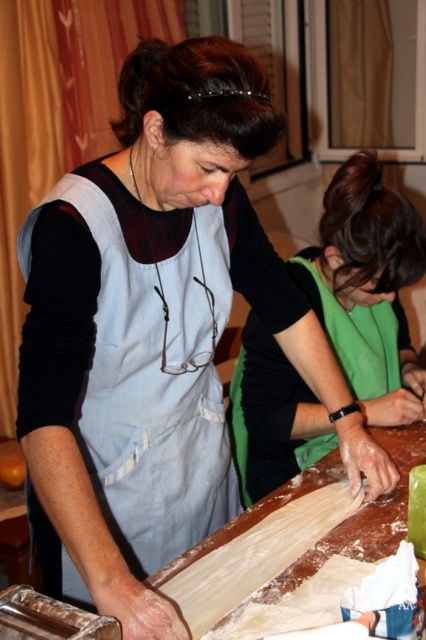
Between light blue fabric apron at center and green fabric apron at center, which one is positioned higher?

green fabric apron at center is higher up.

This screenshot has height=640, width=426. I want to click on light blue fabric apron at center, so click(x=123, y=378).

This screenshot has height=640, width=426. Identify the location of light blue fabric apron at center. (123, 378).